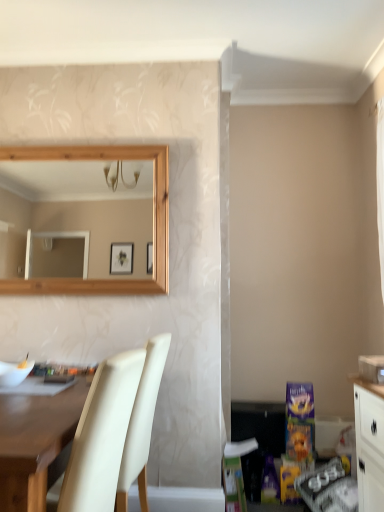
Question: Is point (39, 414) closer or farther from the camera than point (134, 432)?

Choices:
 (A) closer
 (B) farther

Answer: (A)

Question: Do you think matte white desk at lower left is within cream leather chair at lower left, or outside of it?

Choices:
 (A) outside
 (B) inside

Answer: (A)

Question: Would you say matte white desk at lower left is to the left or to the right of cream leather chair at lower left in the picture?

Choices:
 (A) right
 (B) left

Answer: (B)

Question: From the image's perspective, is cream leather chair at lower left above or below matte white desk at lower left?

Choices:
 (A) above
 (B) below

Answer: (A)

Question: Is cream leather chair at lower left taller or shorter than matte white desk at lower left?

Choices:
 (A) short
 (B) tall

Answer: (B)

Question: Considering the positions of point (127, 360) and point (43, 433), is point (127, 360) closer or farther from the camera than point (43, 433)?

Choices:
 (A) closer
 (B) farther

Answer: (B)

Question: Is cream leather chair at lower left in front of or behind matte white desk at lower left in the image?

Choices:
 (A) front
 (B) behind

Answer: (B)